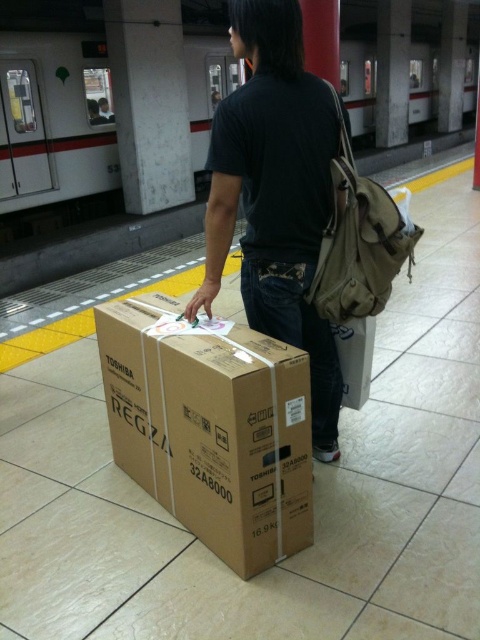
Between brown cardboard box at center and khaki canvas backpack at right, which one is positioned lower?

brown cardboard box at center is lower down.

Can you confirm if brown cardboard box at center is thinner than khaki canvas backpack at right?

Incorrect, brown cardboard box at center's width is not less than khaki canvas backpack at right's.

Measure the distance between point (288, 432) and camera.

They are 1.89 meters apart.

Identify the location of brown cardboard box at center. (211, 428).

This screenshot has height=640, width=480. In order to click on brown cardboard box at center in this screenshot , I will do `click(211, 428)`.

Consider the image. Who is lower down, brown cardboard box at center or black cotton shirt at center?

brown cardboard box at center is below.

Identify the location of brown cardboard box at center. (211, 428).

Identify the location of brown cardboard box at center. This screenshot has width=480, height=640. (211, 428).

Is black cotton shirt at center behind khaki canvas backpack at right?

That is False.

Between black cotton shirt at center and khaki canvas backpack at right, which one appears on the left side from the viewer's perspective?

From the viewer's perspective, black cotton shirt at center appears more on the left side.

Which is in front, point (273, 305) or point (334, 156)?

Positioned in front is point (334, 156).

Where is `black cotton shirt at center`? This screenshot has width=480, height=640. black cotton shirt at center is located at coordinates (276, 195).